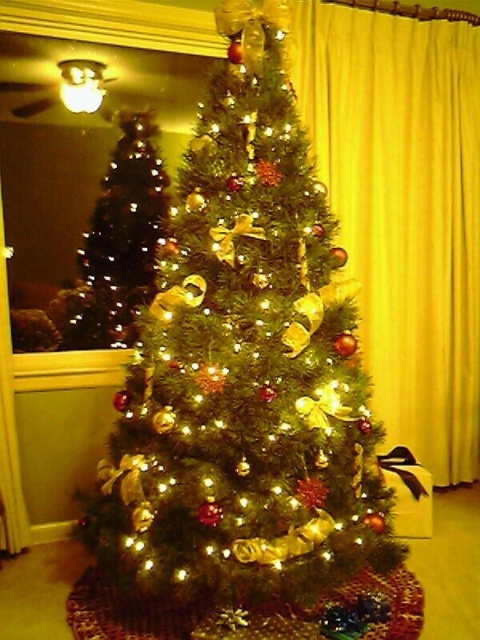
Question: Which point is closer to the camera taking this photo?

Choices:
 (A) (273, 448)
 (B) (433, 406)

Answer: (A)

Question: Where is green matte christmas tree at center located in relation to matte gold christmas tree at left in the image?

Choices:
 (A) right
 (B) left

Answer: (A)

Question: Is green matte christmas tree at center to the left of matte gold christmas tree at left from the viewer's perspective?

Choices:
 (A) no
 (B) yes

Answer: (A)

Question: Which is farther from the matte gold christmas tree at left?

Choices:
 (A) green matte christmas tree at center
 (B) yellow velvet curtain at right

Answer: (B)

Question: Is green matte christmas tree at center further to camera compared to yellow velvet curtain at right?

Choices:
 (A) no
 (B) yes

Answer: (A)

Question: Which object appears farthest from the camera in this image?

Choices:
 (A) green matte christmas tree at center
 (B) yellow velvet curtain at right
 (C) matte gold christmas tree at left

Answer: (B)